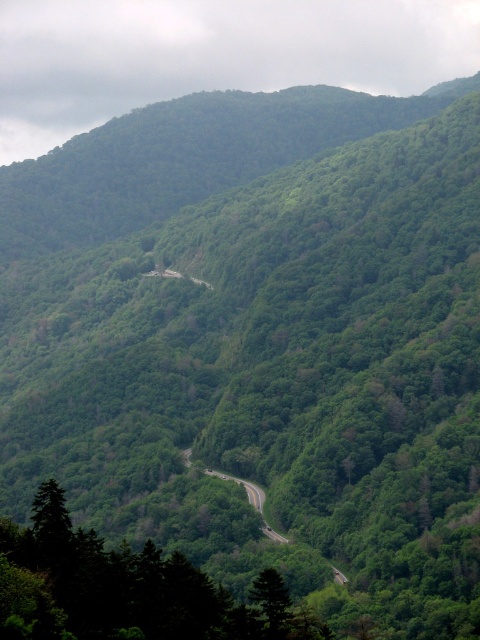
Based on the photo, you are a hiker standing at the base of the green leafy tree at lower left and want to cross the green asphalt road at center. Can you walk straight ahead from the tree to reach the road without deviating left or right? Explain your reasoning based on their widths.

The green leafy tree at lower left has a lesser width compared to the green asphalt road at center. Since the tree is narrower than the road, you can walk straight ahead from the tree to reach the road without deviating left or right because the road is wider and provides enough space for passage.

You are a hiker planning to walk from the green leafy tree at lower left to the green asphalt road at center. According to the map, the distance between them is 132.64 meters. If your average walking speed is 1.5 meters per second, how many minutes will it take you to reach the road?

The distance between the green leafy tree at lower left and the green asphalt road at center is 132.64 meters. At a walking speed of 1.5 meters per second, dividing the distance by speed gives 132.64 m divided by 1.5 m per second equals approximately 88.43 seconds. Converting seconds to minutes by dividing by 60 gives roughly 1.47 minutes. So, it will take about 1.5 minutes to reach the road.

You are a hiker standing at the base of the green leafy tree at lower left and want to reach the green asphalt road at center. Which direction should you walk to get there?

The green asphalt road at center is located in the middle ground of the scene, so you should walk forward away from the green leafy tree at lower left to reach it.